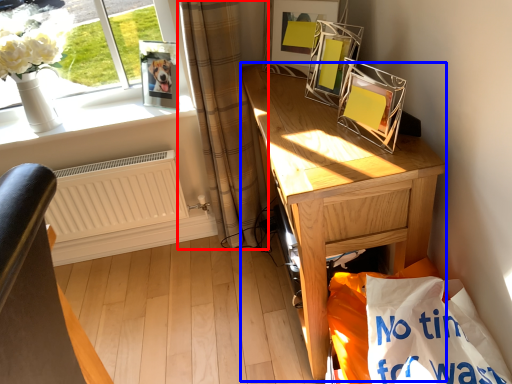
Question: Which point is closer to the camera, curtain (highlighted by a red box) or desk (highlighted by a blue box)?

Choices:
 (A) curtain
 (B) desk

Answer: (B)